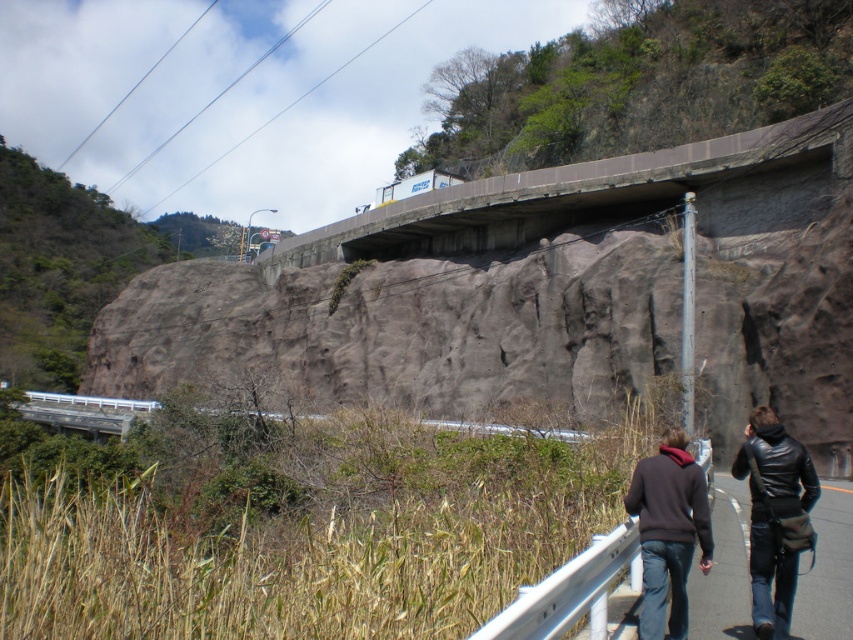
Question: Which is farther from the black leather jacket at lower right?

Choices:
 (A) dark brown leather jacket at lower right
 (B) concrete bridge at upper center

Answer: (B)

Question: Does concrete bridge at upper center have a smaller size compared to dark brown leather jacket at lower right?

Choices:
 (A) no
 (B) yes

Answer: (A)

Question: Observing the image, what is the correct spatial positioning of concrete bridge at upper center in reference to dark brown leather jacket at lower right?

Choices:
 (A) left
 (B) right

Answer: (B)

Question: Which of these objects is positioned closest to the dark brown leather jacket at lower right?

Choices:
 (A) concrete bridge at upper center
 (B) black leather jacket at lower right

Answer: (B)

Question: Which of the following is the farthest from the observer?

Choices:
 (A) (764, 593)
 (B) (547, 232)
 (C) (761, 561)

Answer: (B)

Question: Observing the image, what is the correct spatial positioning of concrete bridge at upper center in reference to black leather jacket at lower right?

Choices:
 (A) right
 (B) left

Answer: (A)